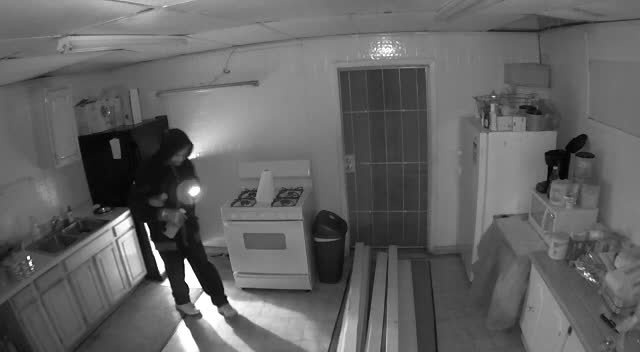
This screenshot has height=352, width=640. Identify the location of refrigerator door. (467, 196).